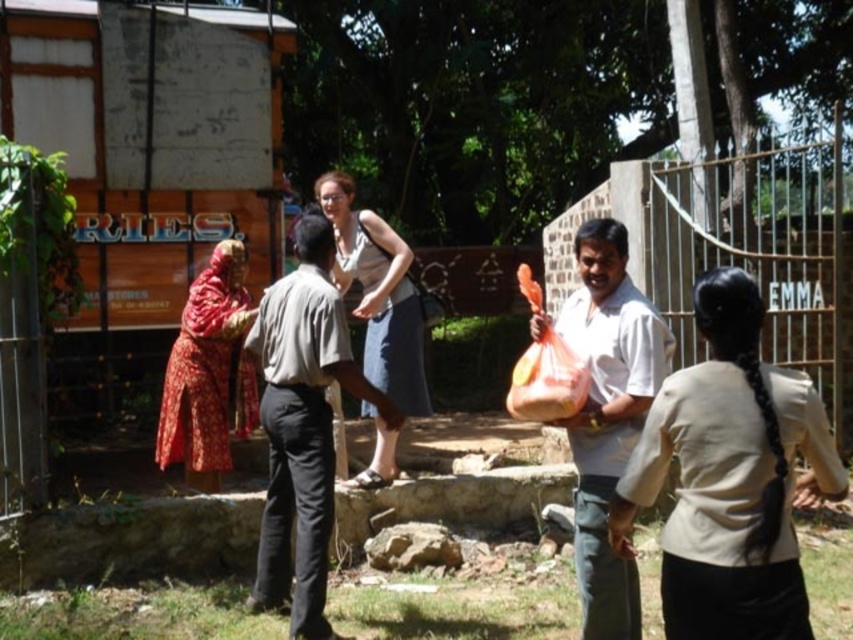
Does white matte shirt at center appear on the left side of translucent orange bag at right?

In fact, white matte shirt at center is to the right of translucent orange bag at right.

Between white matte shirt at center and translucent orange bag at right, which one appears on the right side from the viewer's perspective?

Positioned to the right is white matte shirt at center.

What do you see at coordinates (608, 413) in the screenshot? I see `white matte shirt at center` at bounding box center [608, 413].

Locate an element on the screen. white matte shirt at center is located at coordinates click(608, 413).

Is light brown cotton shirt at center smaller than red floral fabric at left?

Actually, light brown cotton shirt at center might be larger than red floral fabric at left.

Is light brown cotton shirt at center taller than red floral fabric at left?

Yes.

Which is in front, point (376, 396) or point (225, 323)?

Point (376, 396)

You are a GUI agent. You are given a task and a screenshot of the screen. Output one action in this format:
    pyautogui.click(x=<x>, y=<y>)
    Task: Click on the light brown cotton shirt at center
    The image size is (853, 640).
    Given the screenshot: What is the action you would take?
    pyautogui.click(x=302, y=426)

Is beige fabric shirt at center wider than light brown cotton shirt at center?

No.

Which is more to the right, beige fabric shirt at center or light brown cotton shirt at center?

beige fabric shirt at center

Does point (720, 621) lie behind point (299, 304)?

No, it is not.

The image size is (853, 640). Identify the location of beige fabric shirt at center. (730, 477).